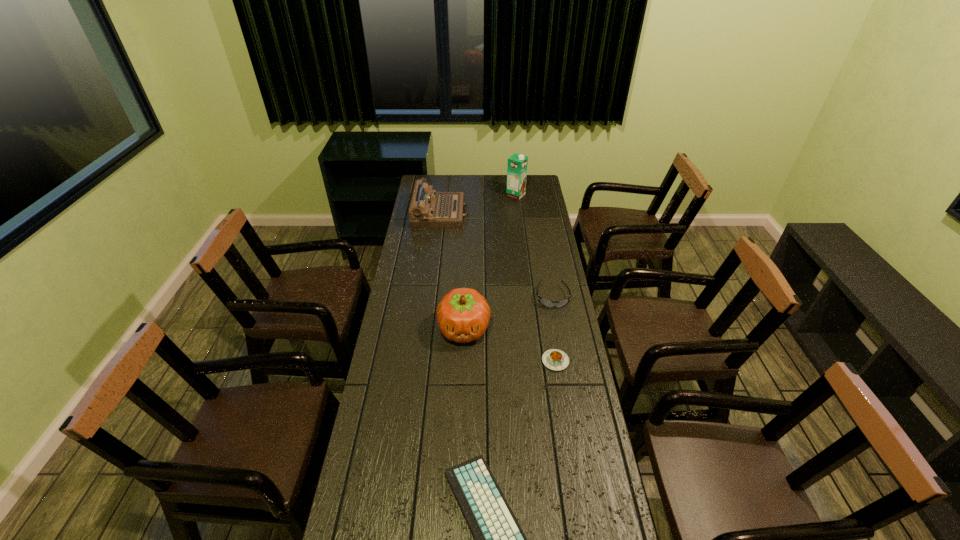
At what (x,y) coordinates should I click in order to perform the action: click on carton. Please return your answer as a coordinate pair (x, y). Image resolution: width=960 pixels, height=540 pixels. Looking at the image, I should click on (517, 165).

I want to click on the fifth shortest object, so click(463, 314).

I want to click on the fourth shortest object, so click(x=428, y=209).

The image size is (960, 540). I want to click on sunglasses, so click(x=546, y=303).

This screenshot has width=960, height=540. In order to click on the fifth farthest object in this screenshot , I will do `click(554, 359)`.

Where is `vacant area situated 0.100m on the left of the tallest object`? This screenshot has width=960, height=540. vacant area situated 0.100m on the left of the tallest object is located at coordinates (489, 195).

Identify the location of vacant area situated 0.330m on the side of the pumpkin with the cute face. (460, 431).

You are a GUI agent. You are given a task and a screenshot of the screen. Output one action in this format:
    pyautogui.click(x=<x>, y=<y>)
    Task: Click on the vacant point located 0.370m on the keyboard of the typewriter
    The height and width of the screenshot is (540, 960).
    Given the screenshot: What is the action you would take?
    pyautogui.click(x=539, y=214)

In order to click on vacant area situated on the lenses of the sunglasses in this screenshot , I will do `click(566, 375)`.

Where is `vacant space positioned on the front of the pudding`? vacant space positioned on the front of the pudding is located at coordinates (565, 423).